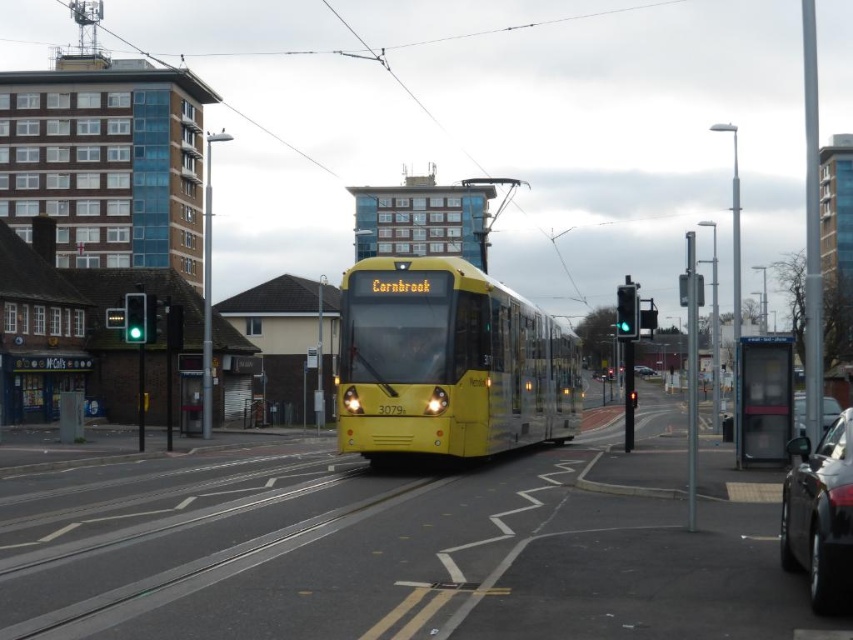
Who is lower down, shiny black car at lower right or metallic silver car at center?

Positioned lower is metallic silver car at center.

At what (x,y) coordinates should I click in order to perform the action: click on shiny black car at lower right. Please return your answer as a coordinate pair (x, y). Looking at the image, I should click on (820, 515).